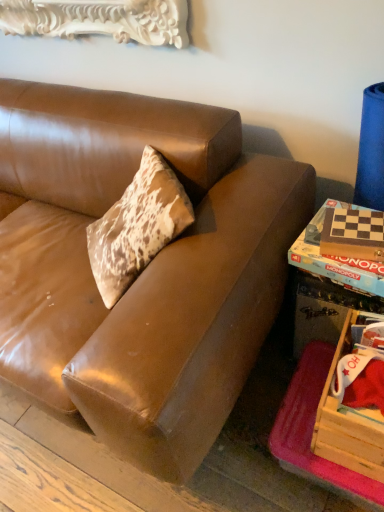
Question: Can you confirm if wooden monopoly game at right, placed as the first book when sorted from back to front, is taller than wooden game board at lower right?

Choices:
 (A) no
 (B) yes

Answer: (A)

Question: Is wooden monopoly game at right, placed as the second book when sorted from front to back, smaller than wooden game board at lower right?

Choices:
 (A) yes
 (B) no

Answer: (A)

Question: Does wooden monopoly game at right, placed as the second book when sorted from front to back, appear on the right side of wooden game board at lower right?

Choices:
 (A) yes
 (B) no

Answer: (B)

Question: From the image's perspective, is wooden monopoly game at right, placed as the second book when sorted from front to back, above wooden game board at lower right?

Choices:
 (A) yes
 (B) no

Answer: (A)

Question: From a real-world perspective, is wooden monopoly game at right, placed as the second book when sorted from front to back, physically above wooden game board at lower right?

Choices:
 (A) yes
 (B) no

Answer: (A)

Question: From the image's perspective, is wooden monopoly game at right, placed as the first book when sorted from back to front, located above or below wooden game board at lower right?

Choices:
 (A) above
 (B) below

Answer: (A)

Question: From a real-world perspective, is wooden monopoly game at right, placed as the first book when sorted from back to front, physically located above or below wooden game board at lower right?

Choices:
 (A) below
 (B) above

Answer: (B)

Question: Is point (307, 236) positioned closer to the camera than point (299, 314)?

Choices:
 (A) closer
 (B) farther

Answer: (A)

Question: Considering the positions of wooden monopoly game at right, placed as the second book when sorted from front to back, and wooden game board at lower right in the image, is wooden monopoly game at right, placed as the second book when sorted from front to back, taller or shorter than wooden game board at lower right?

Choices:
 (A) tall
 (B) short

Answer: (B)

Question: Looking at the image, does white carved wood picture frame at upper left seem bigger or smaller compared to wooden crate at lower right?

Choices:
 (A) small
 (B) big

Answer: (B)

Question: Visually, is white carved wood picture frame at upper left positioned to the left or to the right of wooden crate at lower right?

Choices:
 (A) left
 (B) right

Answer: (A)

Question: From a real-world perspective, is white carved wood picture frame at upper left positioned above or below wooden crate at lower right?

Choices:
 (A) below
 (B) above

Answer: (B)

Question: Relative to wooden crate at lower right, is white carved wood picture frame at upper left in front or behind?

Choices:
 (A) behind
 (B) front

Answer: (A)

Question: Is wooden monopoly game at right, placed as the first book when sorted from back to front, to the left or to the right of checkerboard wood game board at right, the second book from the back, in the image?

Choices:
 (A) right
 (B) left

Answer: (B)

Question: In the image, is wooden monopoly game at right, placed as the second book when sorted from front to back, positioned in front of or behind checkerboard wood game board at right, the first book when ordered from front to back?

Choices:
 (A) behind
 (B) front

Answer: (A)